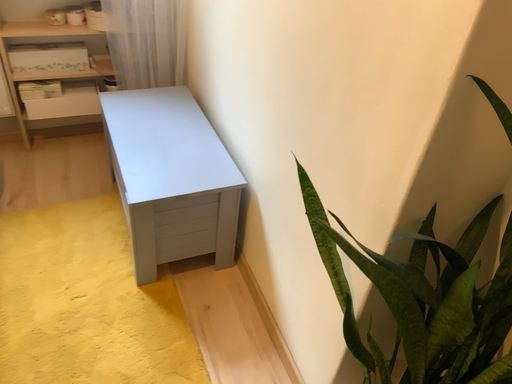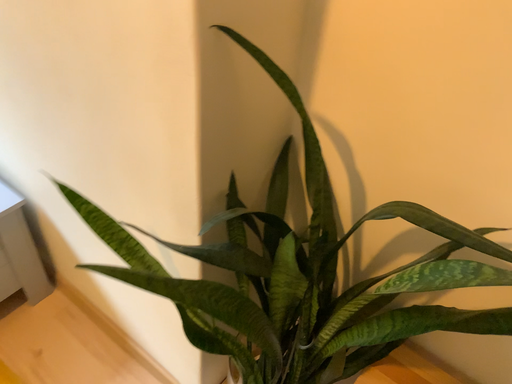
Question: How did the camera likely rotate when shooting the video?

Choices:
 (A) rotated left
 (B) rotated right

Answer: (B)